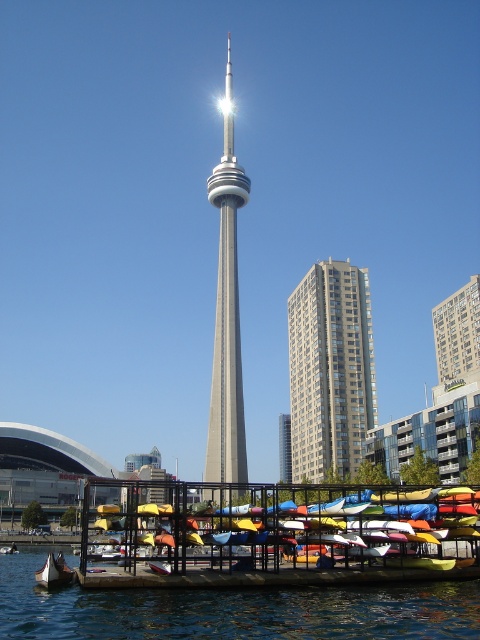
You are planning to launch a kayak from the dock and want to ensure there is enough space between the multicolored plastic kayaks at lower center and the silver metallic cn tower at center. Based on the scene, can you determine if the kayaks are wider than the CN Tower?

The multicolored plastic kayaks at lower center might be wider than silver metallic cn tower at center, so there could be sufficient space for launching the kayak.

You are planning to take a photo of the CN Tower while standing near the multicolored plastic kayaks at lower center. Based on their position, will the kayaks block your view of the CN Tower?

The multicolored plastic kayaks at lower center are located at point (276, 532). Since the CN Tower is the central tall structure in the scene, the coordinates suggest the kayaks are positioned in the lower part of the image, which is the foreground. This means the kayaks are in front of the CN Tower, so they would likely block your view of the CN Tower unless you move to a different position.

You are planning to build a small wooden boat that needs to float on the transparent water at lower center. Considering the height of the beige concrete building at center, will the water level be sufficient for your boat to pass under it without hitting the building?

The transparent water at lower center is shorter than the beige concrete building at center, meaning the water level is lower than the building. Therefore, the boat can safely pass under the building without hitting it as the water is not as high as the building.